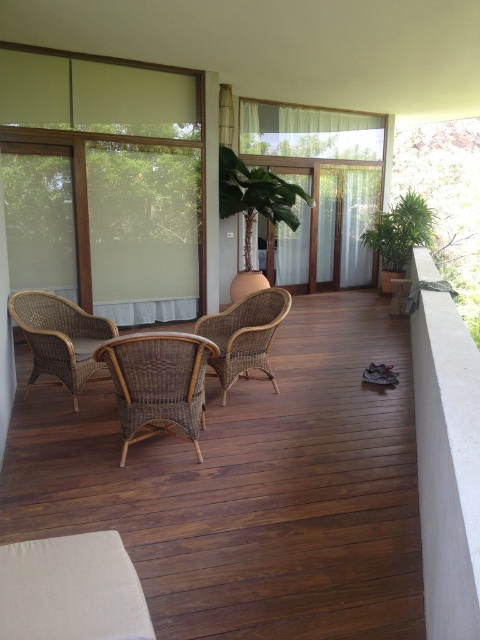
You are standing on the balcony and want to place a small potted plant at the point marked by coordinates point (248,486). However, there are brown wicker chairs at center. Is there enough space to place the plant there?

The point (248,486) is on brown wicker chairs at center, so placing the plant there would not be possible as it is occupied by the chairs.

You are standing on the balcony and want to move from the woven rattan chair at left to the green leafy plant at right. Which direction should you move in?

You should move upward to reach the green leafy plant at right from the woven rattan chair at left because the woven rattan chair at left is located below the green leafy plant at right.

Based on the photo, you are planning to place a rectangular table between the brown wicker chairs at center and the woven rattan chair at left. The table is 1.2 meters wide. Can the table fit between them based on their widths?

The brown wicker chairs at center are wider than the woven rattan chair at left. Since the table is 1.2 meters wide, it depends on the actual width difference between the two chairs. However, since the description only states that the brown wicker chairs at center are wider but does not provide exact measurements, we cannot definitively determine if the table will fit. More specific width information is needed.